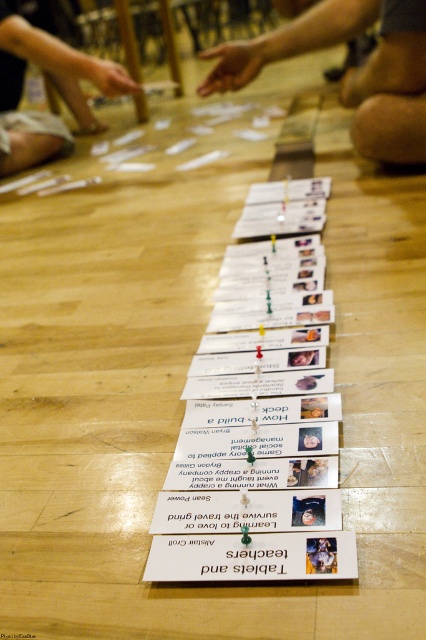
You are a participant in this group activity and need to place a new card between the white paper cards at center and the skinny jeans at center. Based on their positions, where should you place the new card?

The white paper cards at center is below the skinny jeans at center, so you should place the new card between them by positioning it above the white paper cards at center and below the skinny jeans at center.

You are organizing a workshop and need to place a 1cm thick object between the white paper cards at center and the matte black hand at upper left. Can you fit it there?

The white paper cards at center is thinner than matte black hand at upper left, so the 1cm thick object can be placed between them as there is enough space.

You are a photographer trying to capture a photo of the skinny jeans at center and the matte black hand at upper left in the scene. To ensure both are in frame, should you adjust your camera to the left or right?

The skinny jeans at center is to the right of the matte black hand at upper left, so you should adjust your camera to the left to include both in the frame.